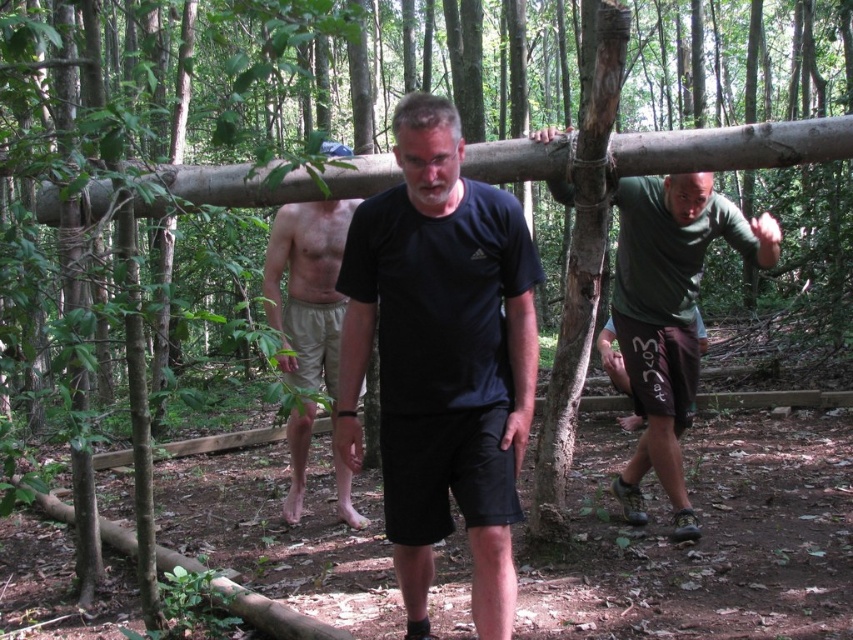
You are a photographer trying to capture the group carrying the log. You want to arrange your camera so that the two points, point (352,312) and point (718,205), are visible in the frame. Based on their positions, which point should be closer to the camera?

Point (352,312) is in front of point (718,205), so it will be closer to the camera.